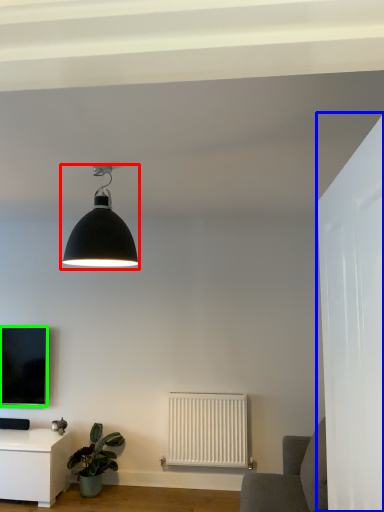
Question: Which object is positioned farthest from lamp (highlighted by a red box)? Select from glass door (highlighted by a blue box) and television (highlighted by a green box).

Choices:
 (A) glass door
 (B) television

Answer: (B)